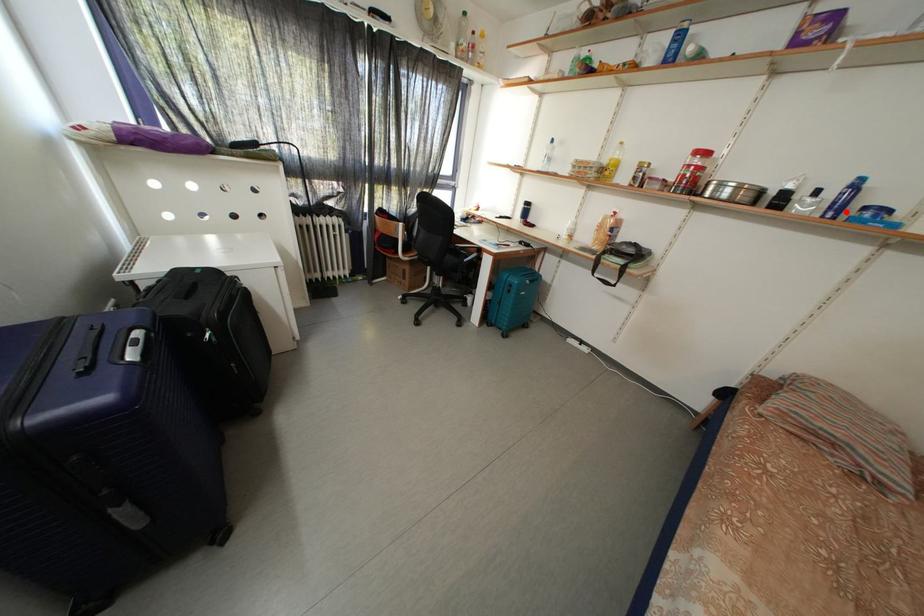
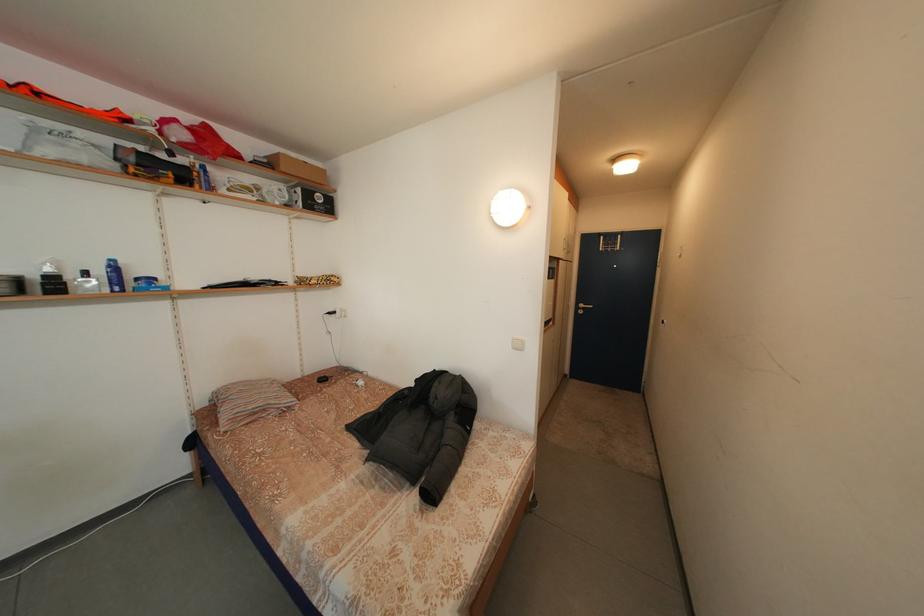
The point at the highlighted location is marked in the first image. Where is the corresponding point in the second image?

(125, 286)